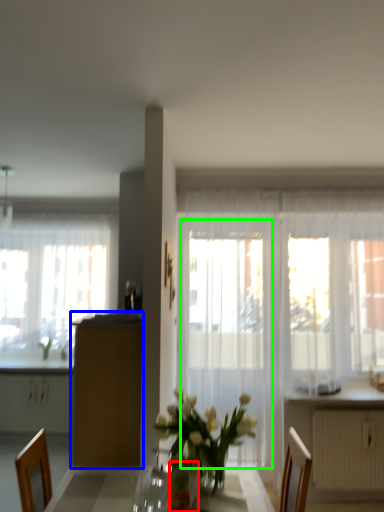
Question: Which object is positioned farthest from vase (highlighted by a red box)? Select from cabinetry (highlighted by a blue box) and screen door (highlighted by a green box).

Choices:
 (A) cabinetry
 (B) screen door

Answer: (B)